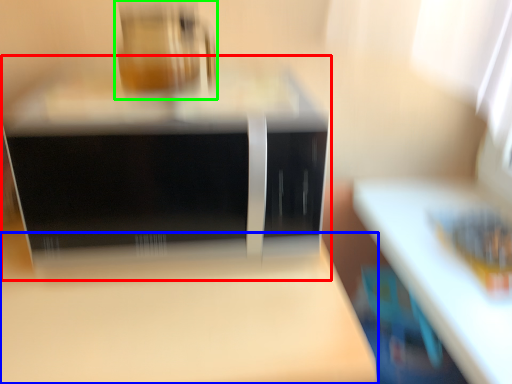
Question: Which object is positioned closest to home appliance (highlighted by a red box)? Select from table (highlighted by a blue box) and appliance (highlighted by a green box).

Choices:
 (A) table
 (B) appliance

Answer: (B)